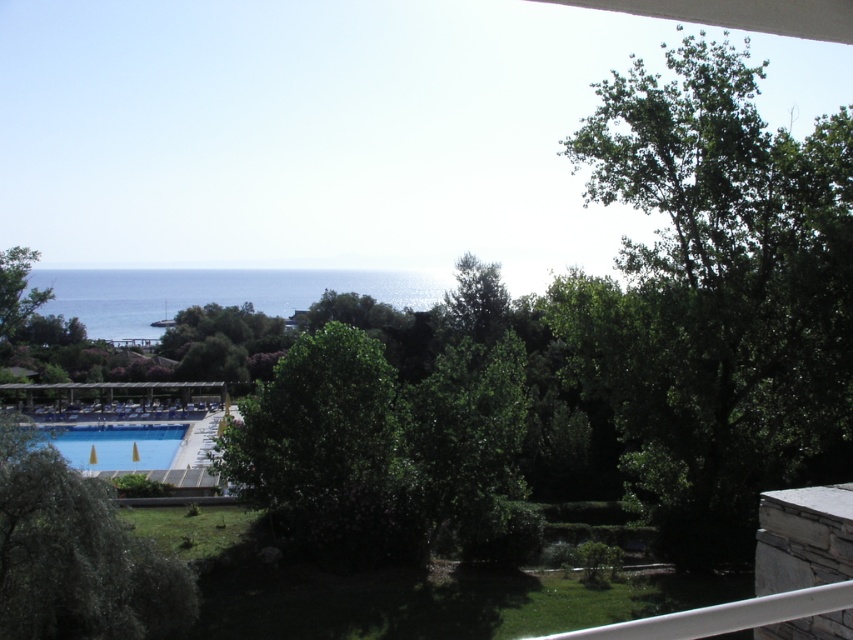
Who is taller, green leafy tree at upper right or green leafy tree at left?

green leafy tree at upper right

Who is higher up, green leafy tree at upper right or green leafy tree at left?

green leafy tree at upper right is above.

Between point (769, 218) and point (25, 268), which one is positioned behind?

Point (25, 268)

The image size is (853, 640). Identify the location of green leafy tree at upper right. (714, 292).

Is green leafy tree at center wider than green leafy tree at left?

Incorrect, green leafy tree at center's width does not surpass green leafy tree at left's.

Who is taller, green leafy tree at center or green leafy tree at left?

Standing taller between the two is green leafy tree at left.

Locate an element on the screen. The width and height of the screenshot is (853, 640). green leafy tree at center is located at coordinates (328, 451).

Is green leafy tree at upper right to the right of green leafy tree at center from the viewer's perspective?

Correct, you'll find green leafy tree at upper right to the right of green leafy tree at center.

Is green leafy tree at upper right taller than green leafy tree at center?

Yes, green leafy tree at upper right is taller than green leafy tree at center.

This screenshot has height=640, width=853. I want to click on green leafy tree at upper right, so click(x=714, y=292).